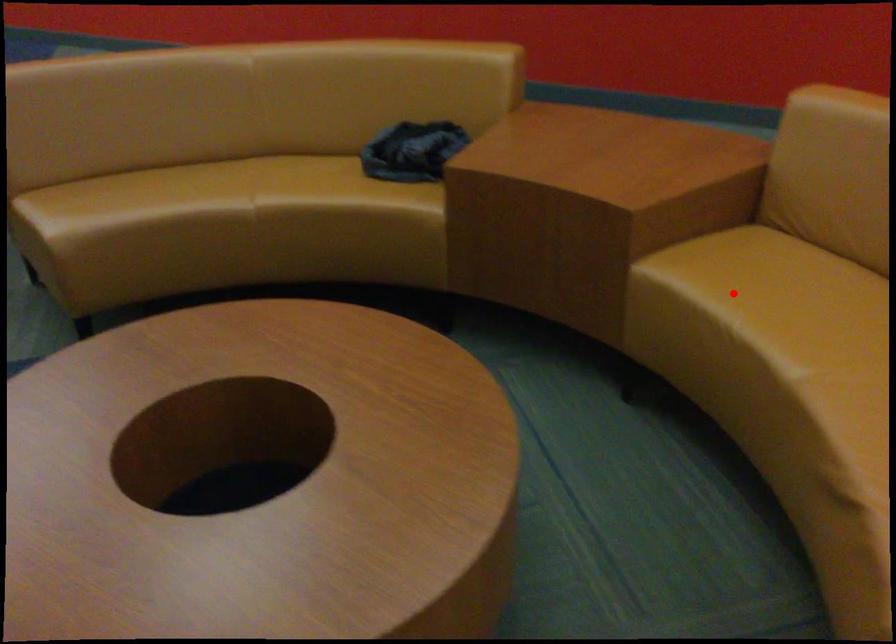
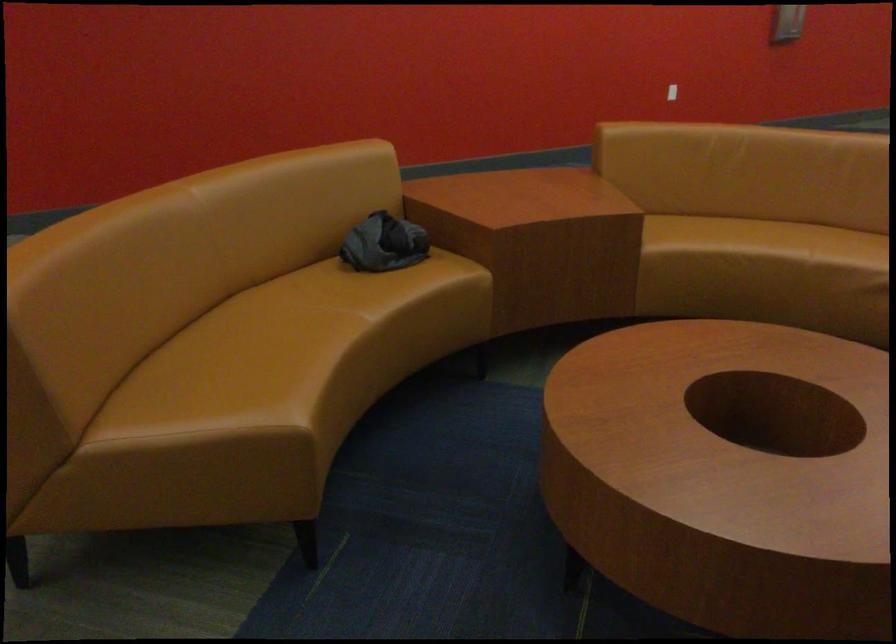
Find the pixel in the second image that matches the highlighted location in the first image.

(719, 242)